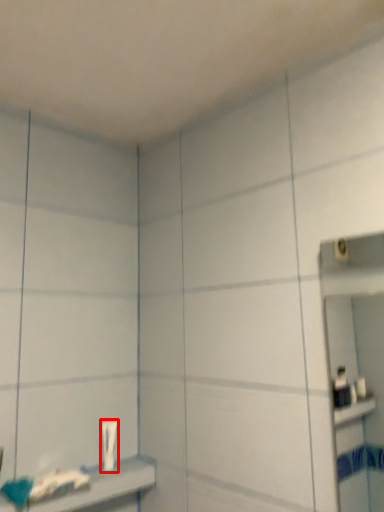
Question: From the image's perspective, considering the relative positions of toothpaste (annotated by the red box) and shelf in the image provided, where is toothpaste (annotated by the red box) located with respect to the staircase?

Choices:
 (A) below
 (B) above

Answer: (B)